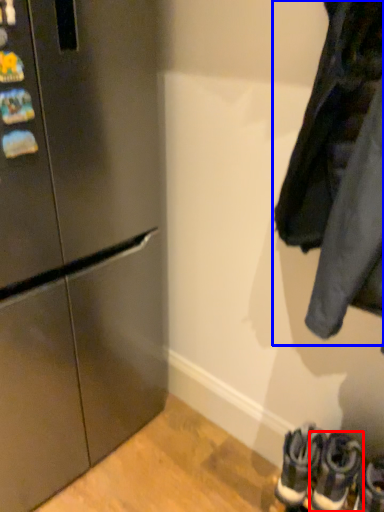
Question: Which object is further to the camera taking this photo, footwear (highlighted by a red box) or jacket (highlighted by a blue box)?

Choices:
 (A) footwear
 (B) jacket

Answer: (A)